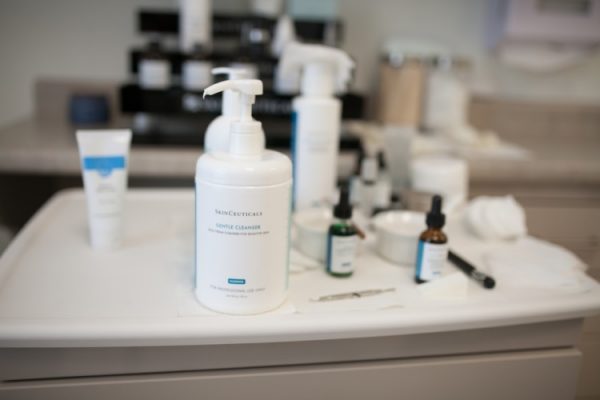
The image size is (600, 400). I want to click on white counter, so click(x=171, y=293).